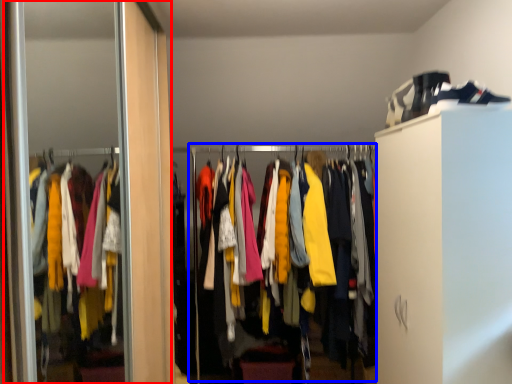
Question: Among these objects, which one is nearest to the camera, screen door (highlighted by a red box) or closet (highlighted by a blue box)?

Choices:
 (A) screen door
 (B) closet

Answer: (A)